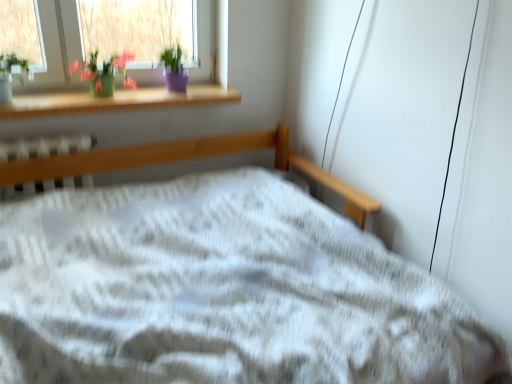
Question: From a real-world perspective, is white plastic radiator at center below green matte vase at upper left?

Choices:
 (A) yes
 (B) no

Answer: (A)

Question: Is white plastic radiator at center positioned before green matte vase at upper left?

Choices:
 (A) yes
 (B) no

Answer: (A)

Question: From the image's perspective, is white plastic radiator at center on green matte vase at upper left?

Choices:
 (A) yes
 (B) no

Answer: (B)

Question: Does white plastic radiator at center touch green matte vase at upper left?

Choices:
 (A) no
 (B) yes

Answer: (A)

Question: Is white plastic radiator at center at the right side of green matte vase at upper left?

Choices:
 (A) no
 (B) yes

Answer: (A)

Question: In terms of height, does wooden at upper left look taller or shorter compared to green matte vase at upper left?

Choices:
 (A) tall
 (B) short

Answer: (B)

Question: Does point (192, 92) appear closer or farther from the camera than point (128, 51)?

Choices:
 (A) farther
 (B) closer

Answer: (A)

Question: Looking at the image, does wooden at upper left seem bigger or smaller compared to green matte vase at upper left?

Choices:
 (A) big
 (B) small

Answer: (A)

Question: From the image's perspective, is wooden at upper left located above or below green matte vase at upper left?

Choices:
 (A) above
 (B) below

Answer: (B)

Question: Is white plastic radiator at center wider or thinner than green matte vase at upper left?

Choices:
 (A) thin
 (B) wide

Answer: (A)

Question: From the image's perspective, is white plastic radiator at center located above or below green matte vase at upper left?

Choices:
 (A) below
 (B) above

Answer: (A)

Question: Is white plastic radiator at center inside or outside of green matte vase at upper left?

Choices:
 (A) outside
 (B) inside

Answer: (A)

Question: From a real-world perspective, is white plastic radiator at center physically located above or below green matte vase at upper left?

Choices:
 (A) above
 (B) below

Answer: (B)

Question: In the image, is green matte vase at upper left on the left side or the right side of wooden at upper left?

Choices:
 (A) right
 (B) left

Answer: (B)

Question: In terms of size, does green matte vase at upper left appear bigger or smaller than wooden at upper left?

Choices:
 (A) small
 (B) big

Answer: (A)